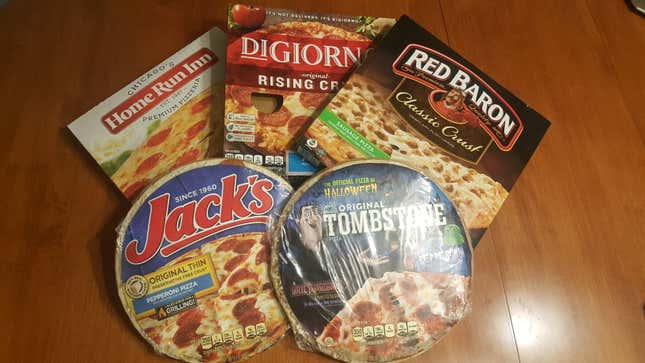
Locate an element on the screen. The height and width of the screenshot is (363, 645). box is located at coordinates (447, 58), (301, 62), (184, 100).